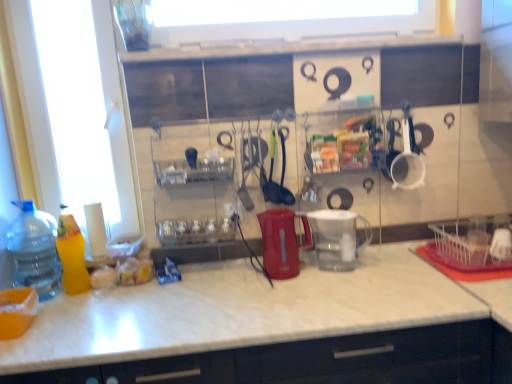
Question: Does transparent plastic pitcher at center, which appears as the 2th appliance when viewed from the left, have a larger size compared to transparent plastic bottle at left, which appears as the 1th bottle when viewed from the left?

Choices:
 (A) no
 (B) yes

Answer: (A)

Question: Is transparent plastic pitcher at center, acting as the 1th appliance starting from the right, shorter than transparent plastic bottle at left, which appears as the 1th bottle when viewed from the left?

Choices:
 (A) yes
 (B) no

Answer: (A)

Question: Is transparent plastic pitcher at center, which appears as the 2th appliance when viewed from the left, at the right side of transparent plastic bottle at left, marked as the second bottle in a right-to-left arrangement?

Choices:
 (A) yes
 (B) no

Answer: (A)

Question: Can you confirm if transparent plastic pitcher at center, acting as the 1th appliance starting from the right, is wider than transparent plastic bottle at left, marked as the second bottle in a right-to-left arrangement?

Choices:
 (A) no
 (B) yes

Answer: (B)

Question: From a real-world perspective, is transparent plastic pitcher at center, acting as the 1th appliance starting from the right, located higher than transparent plastic bottle at left, marked as the second bottle in a right-to-left arrangement?

Choices:
 (A) yes
 (B) no

Answer: (B)

Question: Does transparent plastic pitcher at center, acting as the 1th appliance starting from the right, have a lesser width compared to transparent plastic bottle at left, marked as the second bottle in a right-to-left arrangement?

Choices:
 (A) no
 (B) yes

Answer: (A)

Question: Is green plastic ladle at center, positioned as the 3th tableware in right-to-left order, bigger than black rubber spatula at center, marked as the 2th tableware in a left-to-right arrangement?

Choices:
 (A) yes
 (B) no

Answer: (A)

Question: From the image's perspective, is green plastic ladle at center, which is the first tableware in left-to-right order, located above black rubber spatula at center, marked as the 2th tableware in a left-to-right arrangement?

Choices:
 (A) no
 (B) yes

Answer: (B)

Question: Is green plastic ladle at center, positioned as the 3th tableware in right-to-left order, wider than black rubber spatula at center, marked as the 2th tableware in a left-to-right arrangement?

Choices:
 (A) no
 (B) yes

Answer: (A)

Question: From a real-world perspective, is green plastic ladle at center, positioned as the 3th tableware in right-to-left order, located beneath black rubber spatula at center, the second tableware positioned from the right?

Choices:
 (A) no
 (B) yes

Answer: (A)

Question: Is green plastic ladle at center, positioned as the 3th tableware in right-to-left order, smaller than black rubber spatula at center, marked as the 2th tableware in a left-to-right arrangement?

Choices:
 (A) yes
 (B) no

Answer: (B)

Question: Is green plastic ladle at center, positioned as the 3th tableware in right-to-left order, at the left side of black rubber spatula at center, marked as the 2th tableware in a left-to-right arrangement?

Choices:
 (A) yes
 (B) no

Answer: (A)

Question: From the image's perspective, is green plastic ladle at center, which is the first tableware in left-to-right order, located above white plastic cup at upper right, arranged as the 3th tableware when viewed from the left?

Choices:
 (A) yes
 (B) no

Answer: (B)